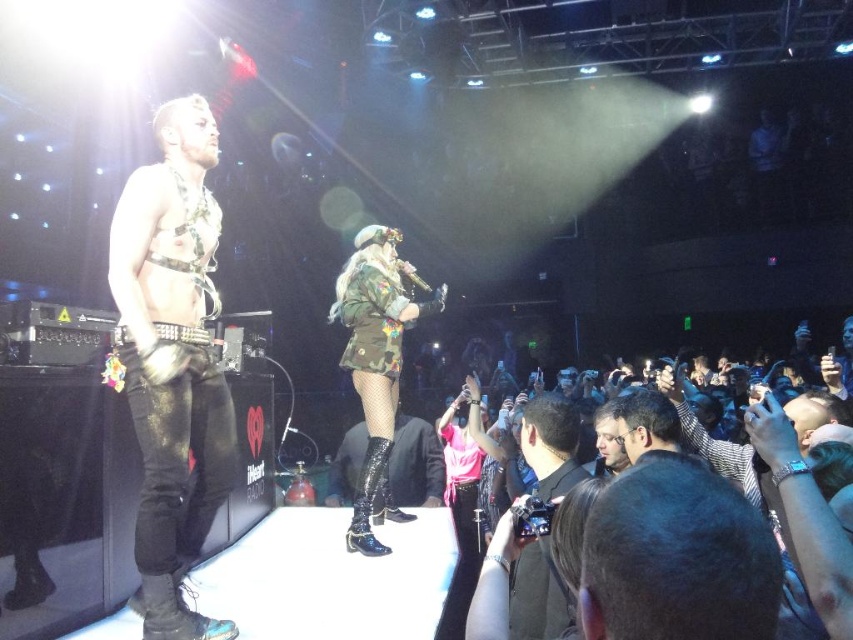
Looking at this image, you are a photographer at the concert venue. You want to take a photo of both the shiny black leather pants at left and the dark brown hair at lower right in the same frame. Your camera has a maximum focus range of 1.8 meters. Can you capture both subjects in focus without moving your position?

The shiny black leather pants at left and dark brown hair at lower right are 1.82 meters apart from each other. Since the distance exceeds the camera maximum focus range of 1.8 meters, you cannot capture both subjects in focus without moving your position.

You are a photographer at the concert venue. You need to capture a closeup shot of the shiny black leather pants at left and the dark brown hair at lower right. Which object should you focus on first if you want to ensure both are in focus without adjusting the camera settings?

The shiny black leather pants at left is larger in size compared to the dark brown hair at lower right, so you should focus on the shiny black leather pants at left first to ensure both are in focus.

You are a photographer at the concert and want to capture both the pink satin dress at center and the glossy patent leather boot at center in a single frame. Which object should you focus on to ensure both are visible without cropping?

The pink satin dress at center is wider than the glossy patent leather boot at center, so focusing on the pink satin dress at center will ensure both objects are visible in the frame.